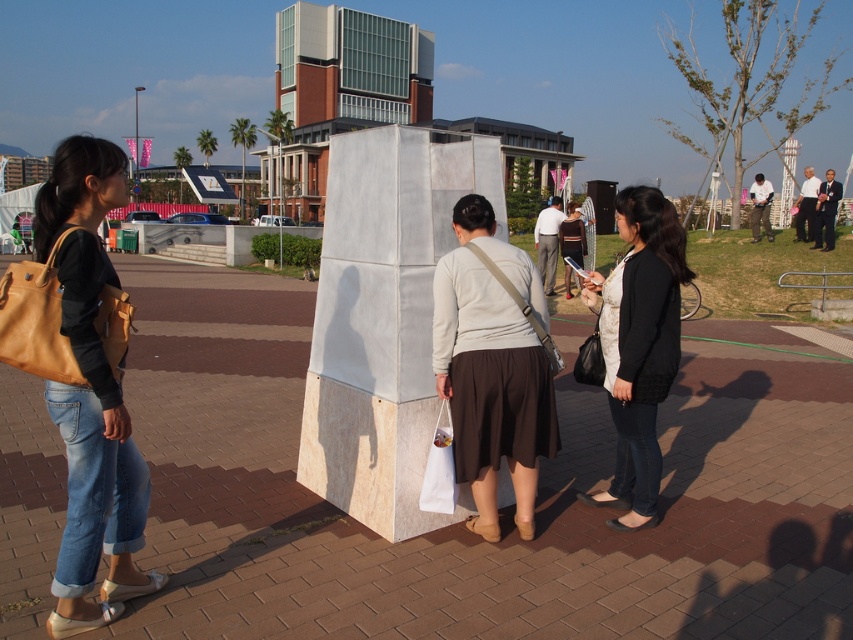
Question: Estimate the real-world distances between objects in this image. Which object is farther from the denim jeans at left?

Choices:
 (A) matte beige sweater at center
 (B) black matte jacket at center
 (C) matte gray cube at center

Answer: (C)

Question: Among these objects, which one is farthest from the camera?

Choices:
 (A) matte beige sweater at center
 (B) black matte jacket at center
 (C) denim jeans at left
 (D) matte gray cube at center

Answer: (D)

Question: Considering the real-world distances, which object is closest to the denim jeans at left?

Choices:
 (A) matte beige sweater at center
 (B) matte gray cube at center

Answer: (A)

Question: Is denim jeans at left smaller than black matte jacket at center?

Choices:
 (A) no
 (B) yes

Answer: (A)

Question: Can you confirm if denim jeans at left is positioned below matte beige sweater at center?

Choices:
 (A) no
 (B) yes

Answer: (A)

Question: Is denim jeans at left wider than black matte jacket at center?

Choices:
 (A) no
 (B) yes

Answer: (B)